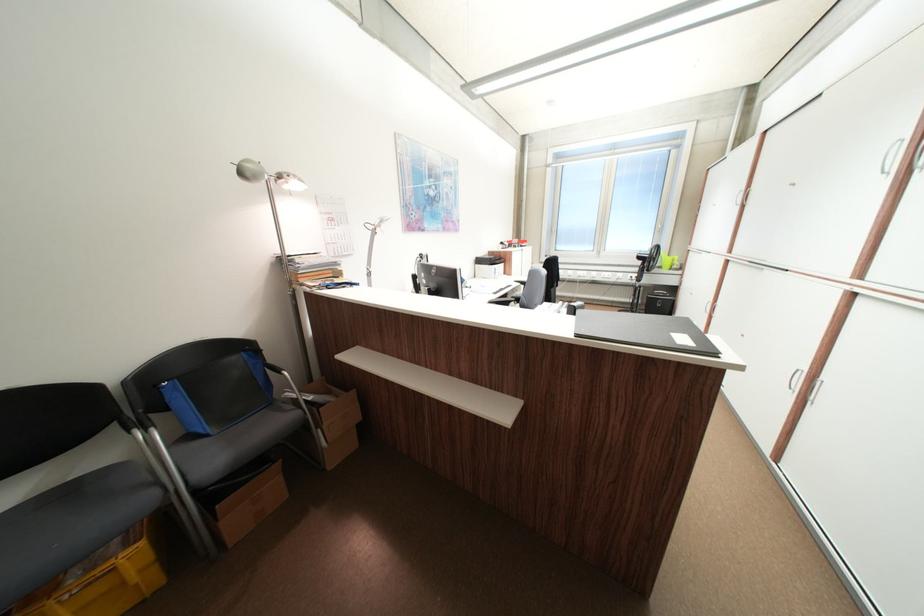
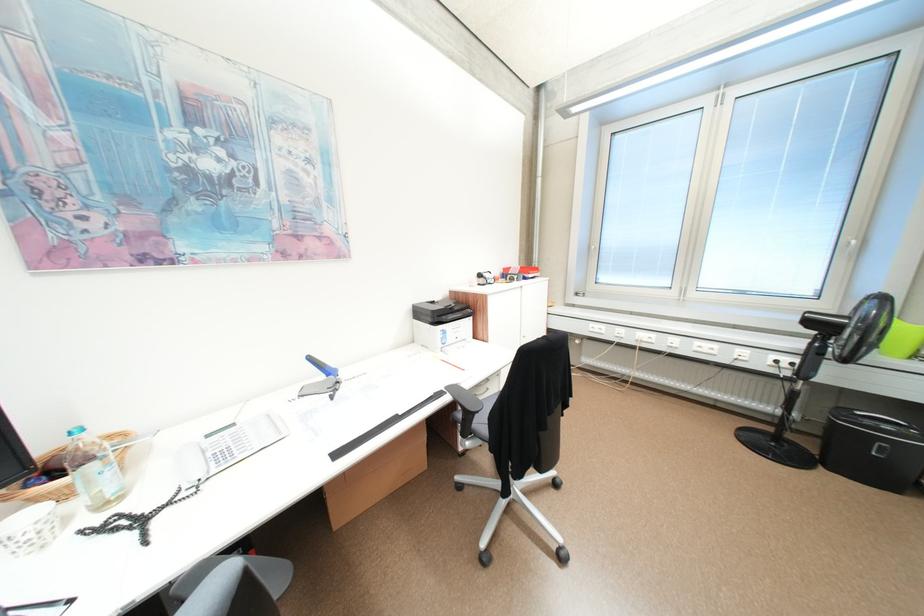
The point at (x=489, y=262) is marked in the first image. Where is the corresponding point in the second image?

(428, 313)